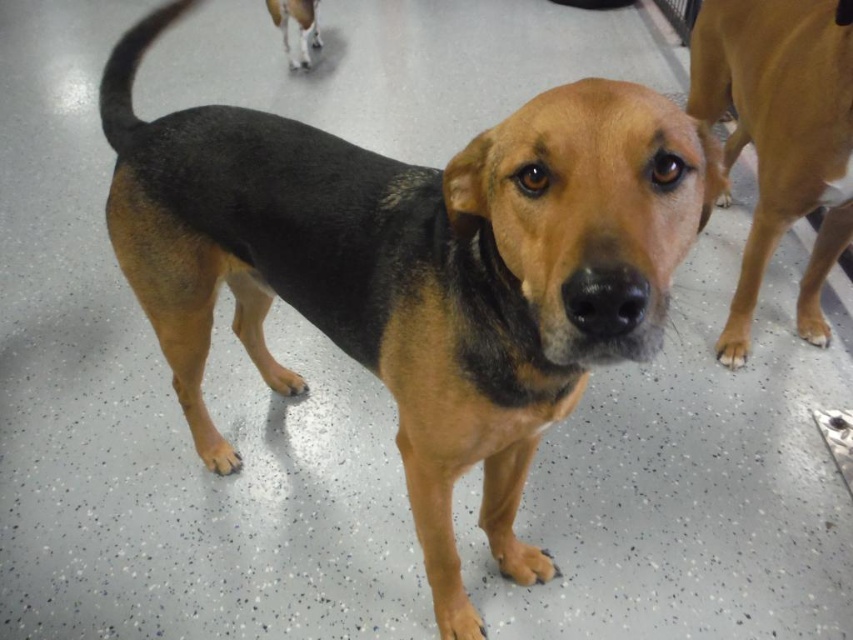
Describe the element at coordinates (415, 269) in the screenshot. I see `brown fur dog at center` at that location.

I want to click on brown fur dog at center, so click(415, 269).

Which is more to the right, brown fur dog at center or white fur at upper center?

brown fur dog at center is more to the right.

Measure the distance between brown fur dog at center and white fur at upper center.

They are 2.60 meters apart.

You are a GUI agent. You are given a task and a screenshot of the screen. Output one action in this format:
    pyautogui.click(x=<x>, y=<y>)
    Task: Click on the brown fur dog at center
    The image size is (853, 640).
    Given the screenshot: What is the action you would take?
    pyautogui.click(x=415, y=269)

Can you confirm if brown matte fur at right is positioned below white fur at upper center?

Yes.

Image resolution: width=853 pixels, height=640 pixels. I want to click on brown matte fur at right, so click(x=780, y=134).